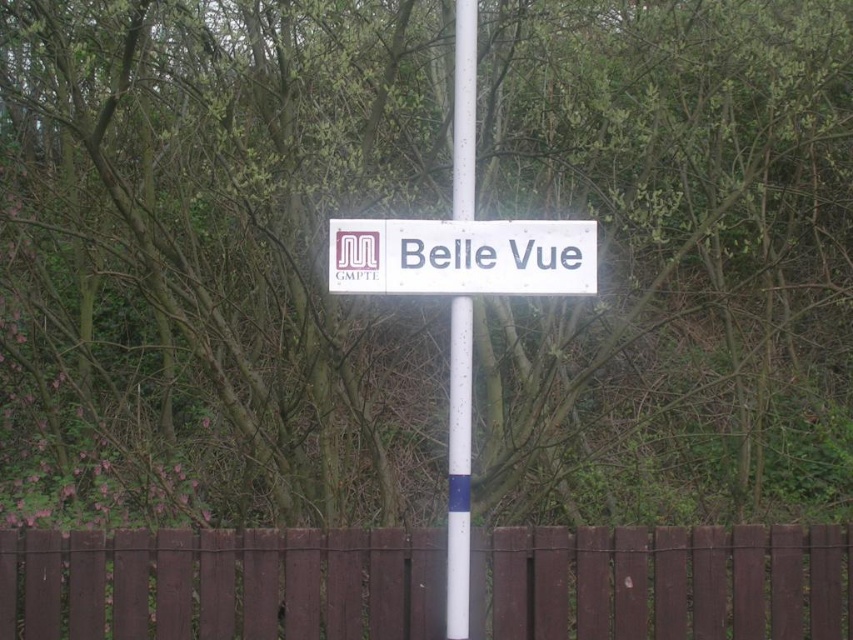
You are a delivery person trying to see the white plastic sign at center from behind the brown wooden fence at center. Can you see the entire sign?

The brown wooden fence at center is taller than white plastic sign at center, so the fence is taller than the sign. Therefore, you cannot see the entire white plastic sign at center from behind the brown wooden fence at center because the fence is taller than the sign.

You are a delivery driver who needs to park your truck near the signpost. The truck requires a space that is wider than the brown wooden fence at center. Can you park your truck next to the white plastic sign at center?

The brown wooden fence at center might be wider than the white plastic sign at center, so it is uncertain whether the truck can park there. Check the actual width before deciding.